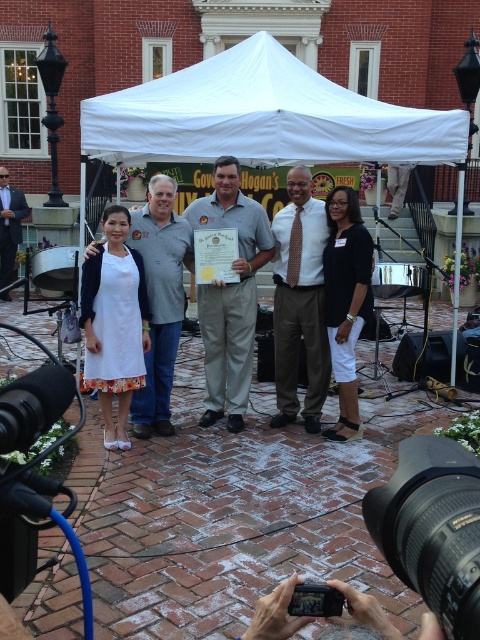
Consider the image. You are a photographer holding a black plastic camera at lower right and want to take a photo of the matte gray shirt at center. Since the camera is thinner than the shirt, can you still take a clear photo of the shirt?

The black plastic camera at lower right is thinner than the matte gray shirt at center, but the camera can still take a clear photo of the matte gray shirt at center as the camera size does not affect the clarity of the photo.

You are a photographer at the event and want to take a photo of the white fabric canopy at center without including the black plastic camera at lower right in the frame. Is it possible to do so by moving to your right?

The white fabric canopy at center is positioned on the left side of black plastic camera at lower right. By moving to your right, you can shift your perspective to exclude the black plastic camera at lower right from the frame while capturing the white fabric canopy at center.